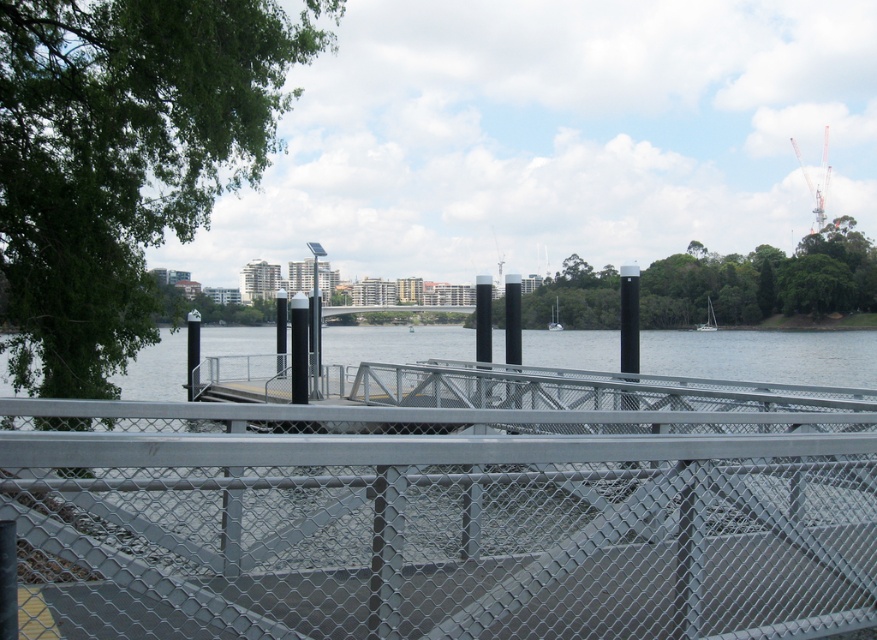
Who is higher up, white glossy sailboat at center or white matte sailboat at center?

white matte sailboat at center is above.

Is white glossy sailboat at center shorter than white matte sailboat at center?

Yes.

Which is behind, point (707, 317) or point (554, 323)?

The point (707, 317) is more distant.

The height and width of the screenshot is (640, 877). What are the coordinates of `white glossy sailboat at center` in the screenshot? It's located at (708, 320).

What do you see at coordinates (453, 509) in the screenshot? I see `metal mesh fence at center` at bounding box center [453, 509].

Is metal mesh fence at center closer to camera compared to white glossy sailboat at center?

Yes, metal mesh fence at center is in front of white glossy sailboat at center.

Measure the distance between metal mesh fence at center and camera.

They are 8.62 feet apart.

The width and height of the screenshot is (877, 640). What are the coordinates of `metal mesh fence at center` in the screenshot? It's located at (453, 509).

What do you see at coordinates (453, 509) in the screenshot? The image size is (877, 640). I see `metal mesh fence at center` at bounding box center [453, 509].

Is point (468, 563) more distant than point (550, 323)?

That is False.

The image size is (877, 640). In order to click on metal mesh fence at center in this screenshot , I will do 453,509.